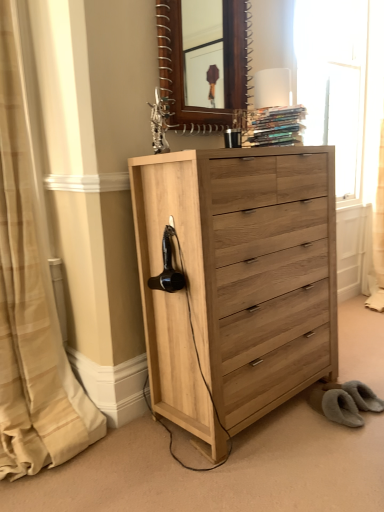
Measure the distance between point (x=297, y=141) and camera.

The depth of point (x=297, y=141) is 1.86 meters.

What do you see at coordinates (30, 308) in the screenshot? The width and height of the screenshot is (384, 512). I see `beige striped curtain at left` at bounding box center [30, 308].

Where is `natural wood chest of drawers at center`? This screenshot has width=384, height=512. natural wood chest of drawers at center is located at coordinates (238, 282).

Is matte white table lamp at upper center in contact with hardcover books at upper center?

There is a gap between matte white table lamp at upper center and hardcover books at upper center.

Is matte white table lamp at upper center thinner than hardcover books at upper center?

Indeed, matte white table lamp at upper center has a lesser width compared to hardcover books at upper center.

Based on the photo, can you confirm if matte white table lamp at upper center is smaller than hardcover books at upper center?

Correct, matte white table lamp at upper center occupies less space than hardcover books at upper center.

Identify the location of table lamp on the right of hardcover books at upper center. This screenshot has width=384, height=512. (272, 88).

In terms of width, does black matte hair dryer at left look wider or thinner when compared to beige striped curtain at left?

Considering their sizes, black matte hair dryer at left looks slimmer than beige striped curtain at left.

Visually, is black matte hair dryer at left positioned to the left or to the right of beige striped curtain at left?

Based on their positions, black matte hair dryer at left is located to the right of beige striped curtain at left.

Image resolution: width=384 pixels, height=512 pixels. In order to click on curtain on the left of black matte hair dryer at left in this screenshot , I will do `click(30, 308)`.

Does point (244, 120) come closer to viewer compared to point (278, 136)?

No, it is behind (278, 136).

Is wooden mirror at upper center oriented towards hardcover books at upper center?

Yes, wooden mirror at upper center is aimed at hardcover books at upper center.

Considering the sizes of objects wooden mirror at upper center and hardcover books at upper center in the image provided, who is taller, wooden mirror at upper center or hardcover books at upper center?

Standing taller between the two is wooden mirror at upper center.

Which is more to the left, wooden mirror at upper center or hardcover books at upper center?

Positioned to the left is wooden mirror at upper center.

From the image's perspective, is black matte hair dryer at left located above matte white table lamp at upper center?

No, from the image's perspective, black matte hair dryer at left is not above matte white table lamp at upper center.

Would you say black matte hair dryer at left is inside or outside matte white table lamp at upper center?

black matte hair dryer at left is outside matte white table lamp at upper center.

From a real-world perspective, which object stands above the other?

matte white table lamp at upper center.

Is matte white table lamp at upper center at the back of black matte hair dryer at left?

black matte hair dryer at left is not turned away from matte white table lamp at upper center.

Is hardcover books at upper center inside beige striped curtain at left?

Definitely not — hardcover books at upper center is not inside beige striped curtain at left.

Does beige striped curtain at left have a greater height compared to hardcover books at upper center?

Yes.

From a real-world perspective, is beige striped curtain at left positioned under hardcover books at upper center based on gravity?

Yes.

What's the angular difference between beige striped curtain at left and hardcover books at upper center's facing directions?

23.2 degrees separate the facing orientations of beige striped curtain at left and hardcover books at upper center.

Is beige striped curtain at left far from matte white table lamp at upper center?

Yes, beige striped curtain at left and matte white table lamp at upper center are quite far apart.

Is beige striped curtain at left facing towards matte white table lamp at upper center?

No, beige striped curtain at left is not turned towards matte white table lamp at upper center.

Can you confirm if beige striped curtain at left is positioned to the right of matte white table lamp at upper center?

No.

Between beige striped curtain at left and matte white table lamp at upper center, which one has larger size?

beige striped curtain at left.

Based on the photo, does hardcover books at upper center appear on the right side of black matte hair dryer at left?

Yes, hardcover books at upper center is to the right of black matte hair dryer at left.

At what (x,y) coordinates should I click in order to perform the action: click on hair drier below the hardcover books at upper center (from the image's perspective). Please return your answer as a coordinate pair (x, y). Looking at the image, I should click on (168, 267).

Is hardcover books at upper center next to black matte hair dryer at left?

No, hardcover books at upper center is not making contact with black matte hair dryer at left.

Who is shorter, hardcover books at upper center or black matte hair dryer at left?

With less height is hardcover books at upper center.

Where is `book below the matte white table lamp at upper center (from the image's perspective)`? book below the matte white table lamp at upper center (from the image's perspective) is located at coordinates (277, 126).

Locate an element on the screen. The image size is (384, 512). hair drier that appears behind the beige striped curtain at left is located at coordinates (168, 267).

From the image, which object appears to be farther from matte white table lamp at upper center, hardcover books at upper center or beige striped curtain at left?

The object further to matte white table lamp at upper center is beige striped curtain at left.

Based on their spatial positions, is black matte hair dryer at left or natural wood chest of drawers at center closer to transparent glass window at upper right?

The object closer to transparent glass window at upper right is natural wood chest of drawers at center.

When comparing their distances from transparent glass window at upper right, does natural wood chest of drawers at center or hardcover books at upper center seem closer?

Among the two, hardcover books at upper center is located nearer to transparent glass window at upper right.

When comparing their distances from matte white table lamp at upper center, does black matte hair dryer at left or transparent glass window at upper right seem further?

The object further to matte white table lamp at upper center is transparent glass window at upper right.

Based on their spatial positions, is black matte hair dryer at left or matte white table lamp at upper center closer to transparent glass window at upper right?

matte white table lamp at upper center is closer to transparent glass window at upper right.

Considering their positions, is beige striped curtain at left positioned closer to hardcover books at upper center than transparent glass window at upper right?

The object closer to hardcover books at upper center is beige striped curtain at left.

Which object lies nearer to the anchor point black matte hair dryer at left, beige striped curtain at left or transparent glass window at upper right?

A: Based on the image, beige striped curtain at left appears to be nearer to black matte hair dryer at left.

Considering their positions, is hardcover books at upper center positioned closer to black matte hair dryer at left than matte white table lamp at upper center?

hardcover books at upper center is positioned closer to the anchor black matte hair dryer at left.

Identify the location of table lamp between hardcover books at upper center and transparent glass window at upper right along the z-axis. The image size is (384, 512). (272, 88).

Where is `chest of drawers between beige striped curtain at left and hardcover books at upper center in the horizontal direction`? Image resolution: width=384 pixels, height=512 pixels. chest of drawers between beige striped curtain at left and hardcover books at upper center in the horizontal direction is located at coordinates (238, 282).

In order to click on mirror between beige striped curtain at left and transparent glass window at upper right in the horizontal direction in this screenshot , I will do `click(204, 63)`.

Locate an element on the screen. This screenshot has width=384, height=512. hair drier that lies between matte white table lamp at upper center and natural wood chest of drawers at center from top to bottom is located at coordinates coord(168,267).